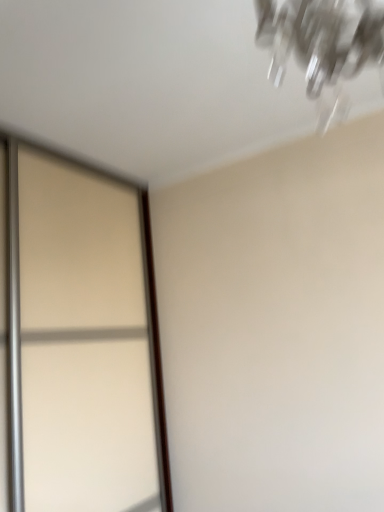
Question: From a real-world perspective, is translucent glass screen door at left positioned above or below clear glass chandelier at upper right?

Choices:
 (A) below
 (B) above

Answer: (A)

Question: In the image, is translucent glass screen door at left positioned in front of or behind clear glass chandelier at upper right?

Choices:
 (A) front
 (B) behind

Answer: (B)

Question: Considering the relative positions of translucent glass screen door at left and clear glass chandelier at upper right in the image provided, is translucent glass screen door at left to the left or to the right of clear glass chandelier at upper right?

Choices:
 (A) right
 (B) left

Answer: (B)

Question: Do you think clear glass chandelier at upper right is within translucent glass screen door at left, or outside of it?

Choices:
 (A) inside
 (B) outside

Answer: (B)

Question: From a real-world perspective, is clear glass chandelier at upper right above or below translucent glass screen door at left?

Choices:
 (A) below
 (B) above

Answer: (B)

Question: Would you say clear glass chandelier at upper right is to the left or to the right of translucent glass screen door at left in the picture?

Choices:
 (A) left
 (B) right

Answer: (B)

Question: From the image's perspective, is clear glass chandelier at upper right above or below translucent glass screen door at left?

Choices:
 (A) below
 (B) above

Answer: (B)